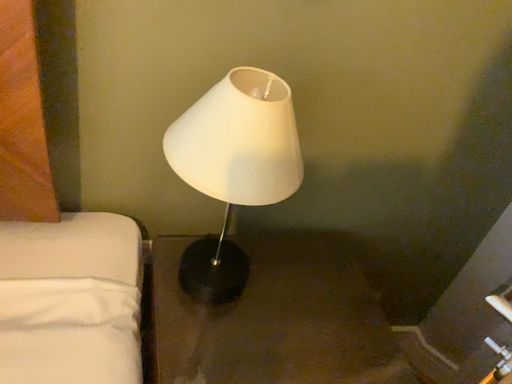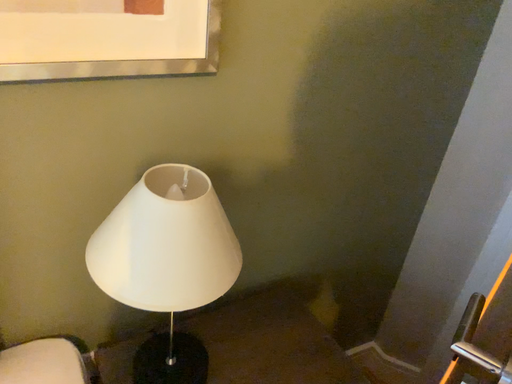
Question: Which way did the camera rotate in the video?

Choices:
 (A) rotated left
 (B) rotated right

Answer: (B)